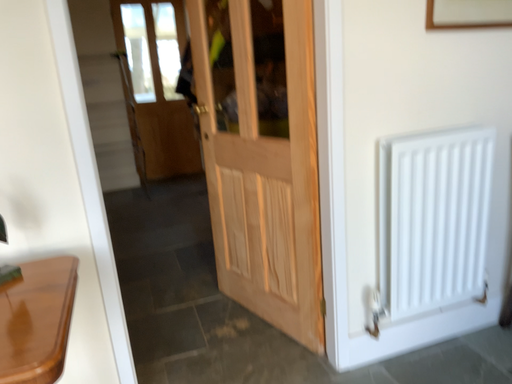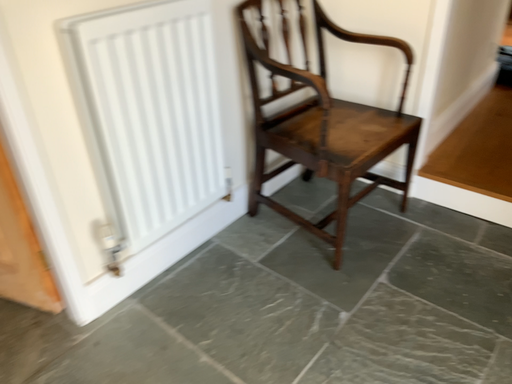
Question: How did the camera likely rotate when shooting the video?

Choices:
 (A) rotated downward
 (B) rotated upward

Answer: (A)